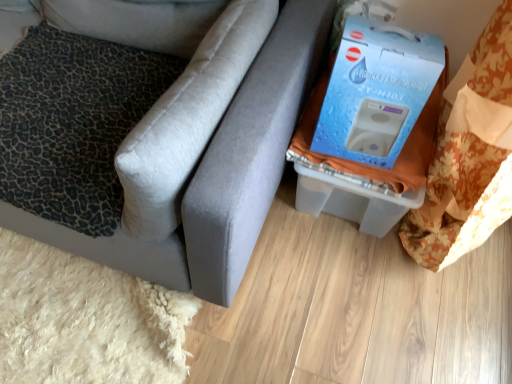
Measure the distance between point (56, 6) and camera.

The depth of point (56, 6) is 1.30 meters.

The height and width of the screenshot is (384, 512). Describe the element at coordinates (221, 172) in the screenshot. I see `matte gray couch at lower right` at that location.

Image resolution: width=512 pixels, height=384 pixels. I want to click on leopard print cushion at left, positioned as the first pillow in top-to-bottom order, so click(x=137, y=21).

Can we say leopard print fabric pillow at left, acting as the 1th pillow starting from the bottom, lies outside matte gray couch at lower right?

No, leopard print fabric pillow at left, acting as the 1th pillow starting from the bottom, is inside or overlapping with matte gray couch at lower right.

Does point (131, 101) come farther from viewer compared to point (278, 86)?

Yes.

Considering the positions of objects leopard print fabric pillow at left, acting as the 1th pillow starting from the bottom, and matte gray couch at lower right in the image provided, who is more to the right, leopard print fabric pillow at left, acting as the 1th pillow starting from the bottom, or matte gray couch at lower right?

leopard print fabric pillow at left, acting as the 1th pillow starting from the bottom.

Which is in front, point (76, 202) or point (132, 19)?

The point (76, 202) is more forward.

Looking at their sizes, would you say leopard print fabric pillow at left, acting as the 1th pillow starting from the bottom, is wider or thinner than leopard print cushion at left, positioned as the second pillow in bottom-to-top order?

Considering their sizes, leopard print fabric pillow at left, acting as the 1th pillow starting from the bottom, looks broader than leopard print cushion at left, positioned as the second pillow in bottom-to-top order.

Can you confirm if leopard print fabric pillow at left, which ranks as the second pillow in top-to-bottom order, is positioned to the left of leopard print cushion at left, positioned as the second pillow in bottom-to-top order?

A: Yes, leopard print fabric pillow at left, which ranks as the second pillow in top-to-bottom order, is to the left of leopard print cushion at left, positioned as the second pillow in bottom-to-top order.

Would you say leopard print fabric pillow at left, acting as the 1th pillow starting from the bottom, is outside leopard print cushion at left, positioned as the first pillow in top-to-bottom order?

That's correct, leopard print fabric pillow at left, acting as the 1th pillow starting from the bottom, is outside of leopard print cushion at left, positioned as the first pillow in top-to-bottom order.

Between leopard print cushion at left, positioned as the second pillow in bottom-to-top order, and leopard print fabric pillow at left, which ranks as the second pillow in top-to-bottom order, which one is positioned behind?

leopard print cushion at left, positioned as the second pillow in bottom-to-top order, is behind.

Does leopard print cushion at left, positioned as the second pillow in bottom-to-top order, have a lesser width compared to leopard print fabric pillow at left, which ranks as the second pillow in top-to-bottom order?

Yes.

How many degrees apart are the facing directions of leopard print cushion at left, positioned as the first pillow in top-to-bottom order, and leopard print fabric pillow at left, which ranks as the second pillow in top-to-bottom order?

The facing directions of leopard print cushion at left, positioned as the first pillow in top-to-bottom order, and leopard print fabric pillow at left, which ranks as the second pillow in top-to-bottom order, are 0.927 degrees apart.

Who is smaller, matte gray couch at lower right or leopard print cushion at left, positioned as the second pillow in bottom-to-top order?

leopard print cushion at left, positioned as the second pillow in bottom-to-top order, is smaller.

Can you tell me how much matte gray couch at lower right and leopard print cushion at left, positioned as the first pillow in top-to-bottom order, differ in facing direction?

The facing directions of matte gray couch at lower right and leopard print cushion at left, positioned as the first pillow in top-to-bottom order, are 0.346 degrees apart.

Is matte gray couch at lower right positioned far away from leopard print cushion at left, positioned as the first pillow in top-to-bottom order?

No, there isn't a large distance between matte gray couch at lower right and leopard print cushion at left, positioned as the first pillow in top-to-bottom order.

From the image's perspective, is matte gray couch at lower right positioned above or below leopard print fabric pillow at left, acting as the 1th pillow starting from the bottom?

matte gray couch at lower right is situated higher than leopard print fabric pillow at left, acting as the 1th pillow starting from the bottom, in the image.

Does matte gray couch at lower right have a greater width compared to leopard print fabric pillow at left, which ranks as the second pillow in top-to-bottom order?

Indeed, matte gray couch at lower right has a greater width compared to leopard print fabric pillow at left, which ranks as the second pillow in top-to-bottom order.

At what (x,y) coordinates should I click in order to perform the action: click on furniture on the left of leopard print fabric pillow at left, acting as the 1th pillow starting from the bottom. Please return your answer as a coordinate pair (x, y). Looking at the image, I should click on (221, 172).

Between matte gray couch at lower right and leopard print fabric pillow at left, which ranks as the second pillow in top-to-bottom order, which one is positioned in front?

matte gray couch at lower right is closer to the camera.

From the image's perspective, which one is positioned higher, leopard print cushion at left, positioned as the first pillow in top-to-bottom order, or matte gray couch at lower right?

From the image's view, leopard print cushion at left, positioned as the first pillow in top-to-bottom order, is above.

Considering the relative sizes of leopard print cushion at left, positioned as the second pillow in bottom-to-top order, and matte gray couch at lower right in the image provided, is leopard print cushion at left, positioned as the second pillow in bottom-to-top order, smaller than matte gray couch at lower right?

Yes.

From a real-world perspective, who is located higher, leopard print cushion at left, positioned as the first pillow in top-to-bottom order, or matte gray couch at lower right?

leopard print cushion at left, positioned as the first pillow in top-to-bottom order, from a real-world perspective.

How different are the orientations of leopard print cushion at left, positioned as the second pillow in bottom-to-top order, and matte gray couch at lower right in degrees?

The angle between the facing direction of leopard print cushion at left, positioned as the second pillow in bottom-to-top order, and the facing direction of matte gray couch at lower right is 0.346 degrees.

This screenshot has width=512, height=384. Identify the location of furniture above the leopard print fabric pillow at left, acting as the 1th pillow starting from the bottom (from the image's perspective). (221, 172).

Where is `pillow lying below the leopard print cushion at left, positioned as the second pillow in bottom-to-top order (from the image's perspective)`? Image resolution: width=512 pixels, height=384 pixels. pillow lying below the leopard print cushion at left, positioned as the second pillow in bottom-to-top order (from the image's perspective) is located at coordinates (73, 123).

Considering their positions, is matte gray couch at lower right positioned closer to leopard print fabric pillow at left, which ranks as the second pillow in top-to-bottom order, than leopard print cushion at left, positioned as the second pillow in bottom-to-top order?

leopard print cushion at left, positioned as the second pillow in bottom-to-top order.

Based on their spatial positions, is leopard print cushion at left, positioned as the second pillow in bottom-to-top order, or leopard print fabric pillow at left, acting as the 1th pillow starting from the bottom, closer to matte gray couch at lower right?

leopard print fabric pillow at left, acting as the 1th pillow starting from the bottom, is closer to matte gray couch at lower right.

Considering their positions, is leopard print fabric pillow at left, which ranks as the second pillow in top-to-bottom order, positioned closer to matte gray couch at lower right than leopard print cushion at left, positioned as the second pillow in bottom-to-top order?

Based on the image, leopard print fabric pillow at left, which ranks as the second pillow in top-to-bottom order, appears to be nearer to matte gray couch at lower right.

Looking at this image, estimate the real-world distances between objects in this image. Which object is closer to leopard print cushion at left, positioned as the first pillow in top-to-bottom order, leopard print fabric pillow at left, which ranks as the second pillow in top-to-bottom order, or matte gray couch at lower right?

leopard print fabric pillow at left, which ranks as the second pillow in top-to-bottom order, is positioned closer to the anchor leopard print cushion at left, positioned as the first pillow in top-to-bottom order.

Based on their spatial positions, is leopard print cushion at left, positioned as the first pillow in top-to-bottom order, or matte gray couch at lower right closer to leopard print fabric pillow at left, which ranks as the second pillow in top-to-bottom order?

Based on the image, leopard print cushion at left, positioned as the first pillow in top-to-bottom order, appears to be nearer to leopard print fabric pillow at left, which ranks as the second pillow in top-to-bottom order.

Based on their spatial positions, is matte gray couch at lower right or leopard print fabric pillow at left, which ranks as the second pillow in top-to-bottom order, further from leopard print cushion at left, positioned as the first pillow in top-to-bottom order?

The object further to leopard print cushion at left, positioned as the first pillow in top-to-bottom order, is matte gray couch at lower right.

The width and height of the screenshot is (512, 384). I want to click on pillow between matte gray couch at lower right and leopard print cushion at left, positioned as the first pillow in top-to-bottom order, in the front-back direction, so click(x=73, y=123).